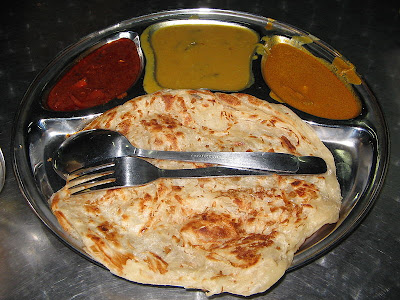
Identify the location of inside of dish. (223, 224), (246, 246), (349, 158), (49, 143).